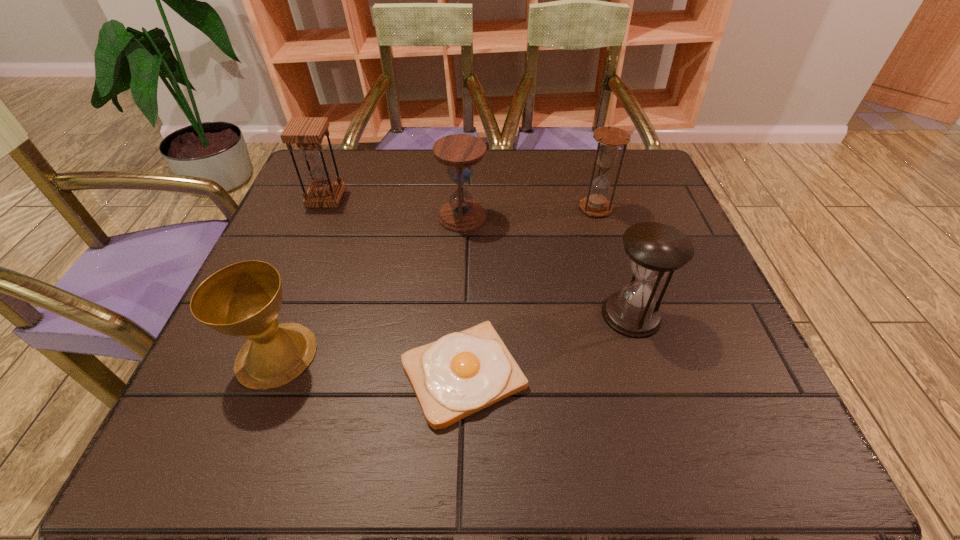
This screenshot has height=540, width=960. Find the location of `free space that is in between the shortest object and the leftmost hourglass`. free space that is in between the shortest object and the leftmost hourglass is located at coordinates (395, 286).

This screenshot has width=960, height=540. Find the location of `free point between the chalice and the third hourglass from right to left`. free point between the chalice and the third hourglass from right to left is located at coordinates (369, 286).

This screenshot has width=960, height=540. Identify the location of vacant area that lies between the second hourglass from left to right and the chalice. (369, 286).

This screenshot has width=960, height=540. Identify the location of empty location between the second hourglass from left to right and the chalice. (369, 286).

Identify the location of vacant region between the shortest object and the leftmost hourglass. (395, 286).

At what (x,y) coordinates should I click in order to perform the action: click on free area in between the leftmost hourglass and the shortest object. Please return your answer as a coordinate pair (x, y). The width and height of the screenshot is (960, 540). Looking at the image, I should click on (395, 286).

This screenshot has height=540, width=960. I want to click on unoccupied position between the second hourglass from left to right and the toast, so click(463, 295).

Locate which object is the fifth closest to the nearest hourglass. Please provide its 2D coordinates. Your answer should be formatted as a tuple, i.e. [(x, y)], where the tuple contains the x and y coordinates of a point satisfying the conditions above.

[(307, 132)]

Locate which object is the closest to the leftmost hourglass. Please provide its 2D coordinates. Your answer should be formatted as a tuple, i.e. [(x, y)], where the tuple contains the x and y coordinates of a point satisfying the conditions above.

[(459, 152)]

The width and height of the screenshot is (960, 540). I want to click on hourglass that is the third closest one to the second hourglass from left to right, so click(655, 249).